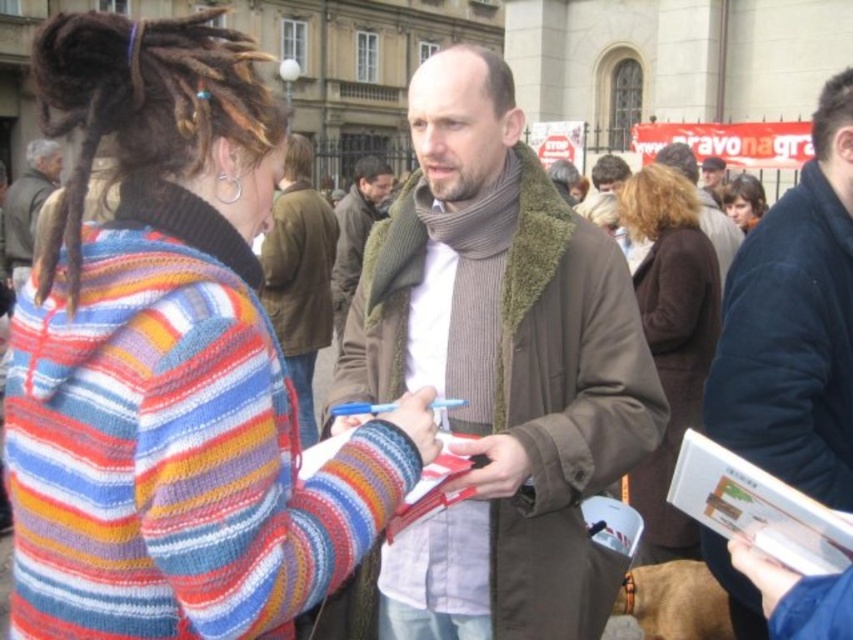
Between knitted wool sweater at center and knitted scarf at center, which one is positioned lower?

knitted wool sweater at center

Which is more to the right, knitted wool sweater at center or knitted scarf at center?

knitted scarf at center

Find the location of a particular element. The height and width of the screenshot is (640, 853). knitted wool sweater at center is located at coordinates (172, 364).

Does point (711, 433) come closer to viewer compared to point (376, 211)?

Yes, point (711, 433) is in front of point (376, 211).

Is point (746, 609) behind point (369, 218)?

No, (746, 609) is in front of (369, 218).

Where is `dark blue fleece jacket at center`? This screenshot has height=640, width=853. dark blue fleece jacket at center is located at coordinates (793, 323).

Can you confirm if brown wool coat at center is positioned above smooth brown hair at upper right?

No, brown wool coat at center is not above smooth brown hair at upper right.

Is brown wool coat at center bigger than smooth brown hair at upper right?

Correct, brown wool coat at center is larger in size than smooth brown hair at upper right.

Is point (677, 227) farther from camera compared to point (747, 212)?

No, (677, 227) is closer to viewer.

Find the location of a particular element. The width and height of the screenshot is (853, 640). brown wool coat at center is located at coordinates (670, 339).